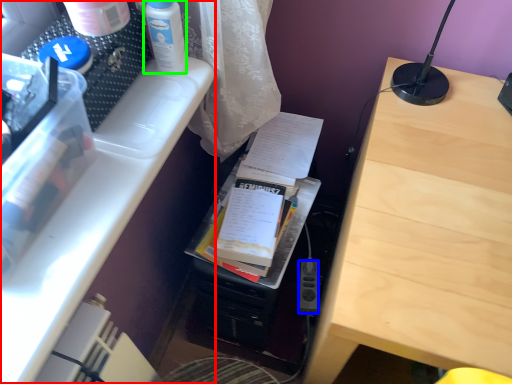
Question: Which object is the closest to the desk (highlighted by a red box)? Choose among these: power plugs and sockets (highlighted by a blue box) or bottle (highlighted by a green box).

Choices:
 (A) power plugs and sockets
 (B) bottle

Answer: (B)